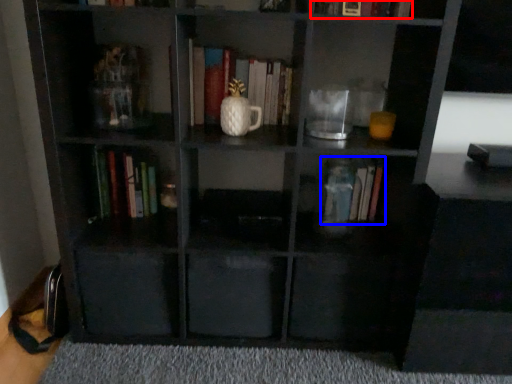
Question: Which point is further to the camera, book (highlighted by a red box) or book (highlighted by a blue box)?

Choices:
 (A) book
 (B) book

Answer: (B)